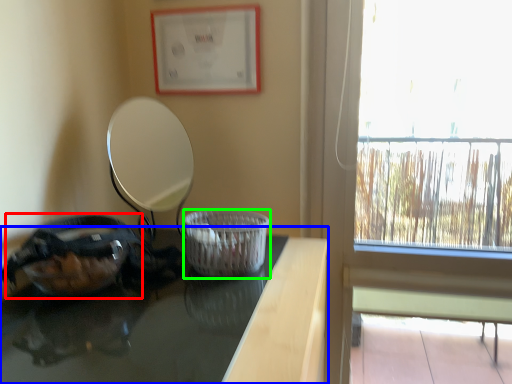
Question: Which object is positioned farthest from glass bowl (highlighted by a red box)? Select from table (highlighted by a blue box) and basket container (highlighted by a green box).

Choices:
 (A) table
 (B) basket container

Answer: (B)